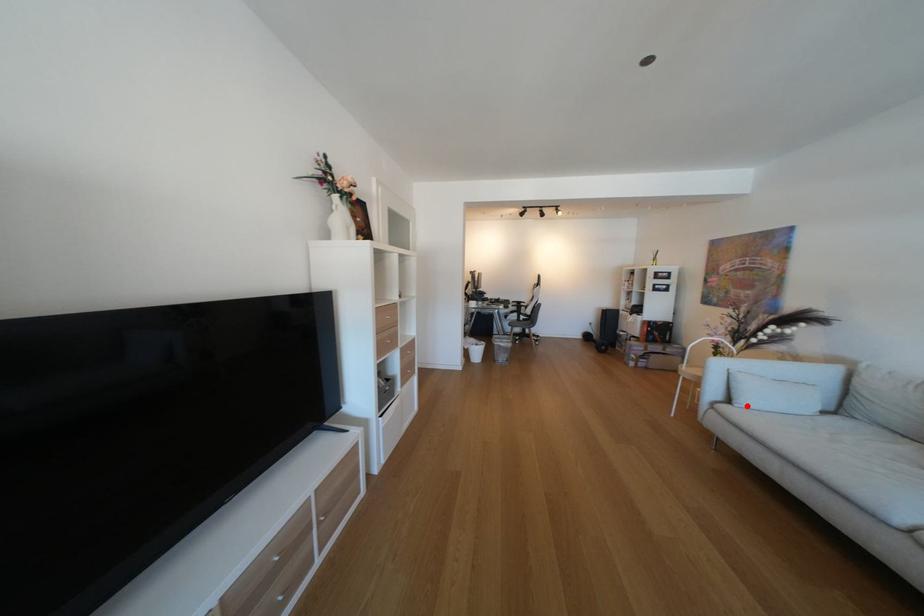
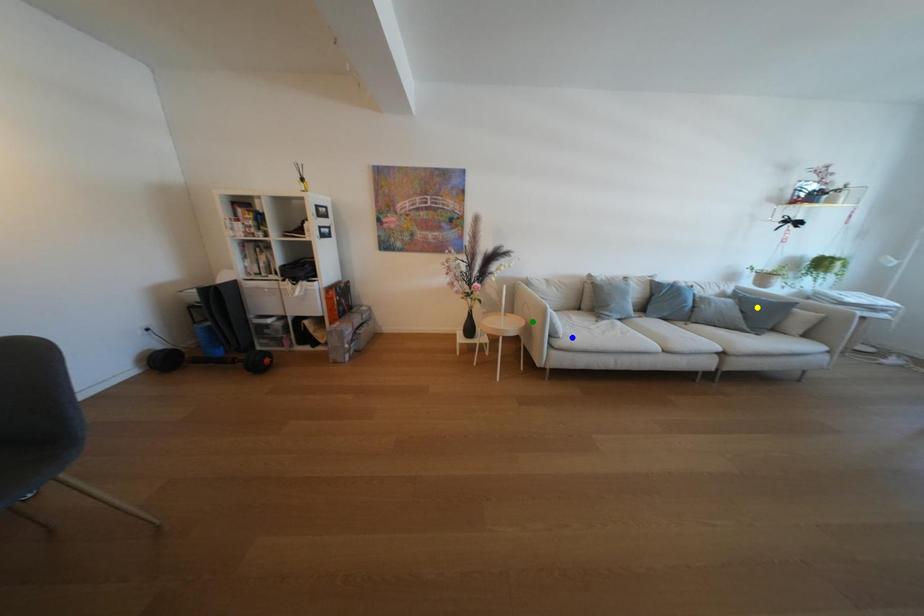
Question: I am providing you with two images of the same scene from different viewpoints. A red point is marked on the first image. You are given multiple points on the second image. Which point in image 2 is actually the same real-world point as the red point in image 1?

Choices:
 (A) yellow point
 (B) green point
 (C) blue point

Answer: (C)